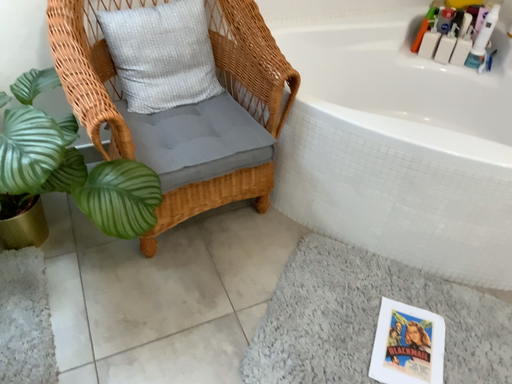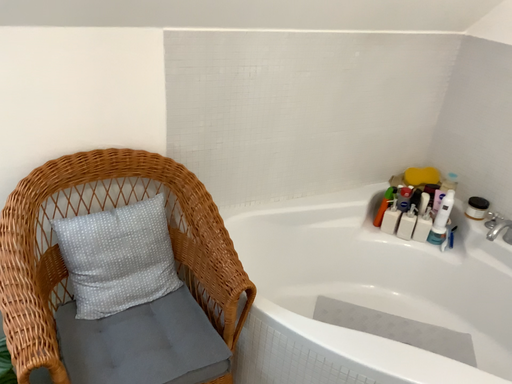
Question: How did the camera likely rotate when shooting the video?

Choices:
 (A) rotated downward
 (B) rotated upward

Answer: (B)